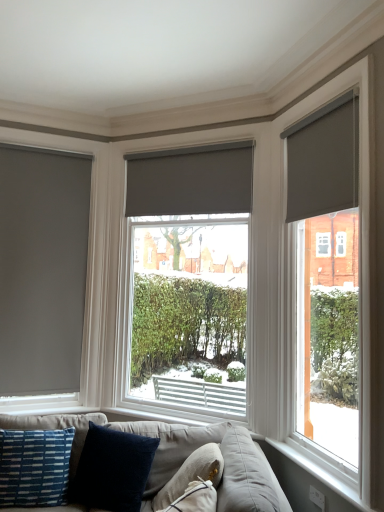
Question: Would you say soft gray fabric couch at lower center is part of velvet dark blue pillow at lower center, arranged as the second pillow when viewed from the right,'s contents?

Choices:
 (A) no
 (B) yes

Answer: (A)

Question: Is velvet dark blue pillow at lower center, arranged as the 3th pillow when viewed from the left, to the left of soft gray fabric couch at lower center from the viewer's perspective?

Choices:
 (A) yes
 (B) no

Answer: (A)

Question: Does velvet dark blue pillow at lower center, arranged as the 3th pillow when viewed from the left, have a greater width compared to soft gray fabric couch at lower center?

Choices:
 (A) yes
 (B) no

Answer: (B)

Question: Can you confirm if velvet dark blue pillow at lower center, arranged as the 3th pillow when viewed from the left, is bigger than soft gray fabric couch at lower center?

Choices:
 (A) no
 (B) yes

Answer: (A)

Question: Is velvet dark blue pillow at lower center, arranged as the second pillow when viewed from the right, closer to the viewer compared to soft gray fabric couch at lower center?

Choices:
 (A) no
 (B) yes

Answer: (B)

Question: Considering the positions of point (347, 233) and point (182, 330), is point (347, 233) closer or farther from the camera than point (182, 330)?

Choices:
 (A) farther
 (B) closer

Answer: (B)

Question: Looking at their shapes, would you say matte gray roller blind at right, marked as the first window in a right-to-left arrangement, is wider or thinner than matte gray roller blind at center, marked as the second window in a left-to-right arrangement?

Choices:
 (A) thin
 (B) wide

Answer: (A)

Question: From the image's perspective, is matte gray roller blind at right, marked as the first window in a right-to-left arrangement, positioned above or below matte gray roller blind at center, marked as the second window in a left-to-right arrangement?

Choices:
 (A) above
 (B) below

Answer: (A)

Question: Considering the positions of matte gray roller blind at right, marked as the first window in a right-to-left arrangement, and matte gray roller blind at center, marked as the 2th window in a right-to-left arrangement, in the image, is matte gray roller blind at right, marked as the first window in a right-to-left arrangement, bigger or smaller than matte gray roller blind at center, marked as the 2th window in a right-to-left arrangement,?

Choices:
 (A) big
 (B) small

Answer: (B)

Question: Considering their positions, is velvet dark blue pillow at lower center, arranged as the second pillow when viewed from the right, located in front of or behind matte gray roller blind at center, marked as the second window in a left-to-right arrangement?

Choices:
 (A) behind
 (B) front

Answer: (B)

Question: From the image's perspective, is velvet dark blue pillow at lower center, arranged as the second pillow when viewed from the right, positioned above or below matte gray roller blind at center, marked as the 2th window in a right-to-left arrangement?

Choices:
 (A) above
 (B) below

Answer: (B)

Question: Does point (167, 453) appear closer or farther from the camera than point (137, 206)?

Choices:
 (A) closer
 (B) farther

Answer: (A)

Question: Is velvet dark blue pillow at lower center, arranged as the 3th pillow when viewed from the left, taller or shorter than matte gray roller blind at center, marked as the second window in a left-to-right arrangement?

Choices:
 (A) short
 (B) tall

Answer: (A)

Question: Is matte gray roller blind at center, acting as the 2th window blind starting from the front, to the left or to the right of white plastic window sill at lower right in the image?

Choices:
 (A) right
 (B) left

Answer: (B)

Question: From a real-world perspective, is matte gray roller blind at center, acting as the 2th window blind starting from the front, above or below white plastic window sill at lower right?

Choices:
 (A) below
 (B) above

Answer: (B)